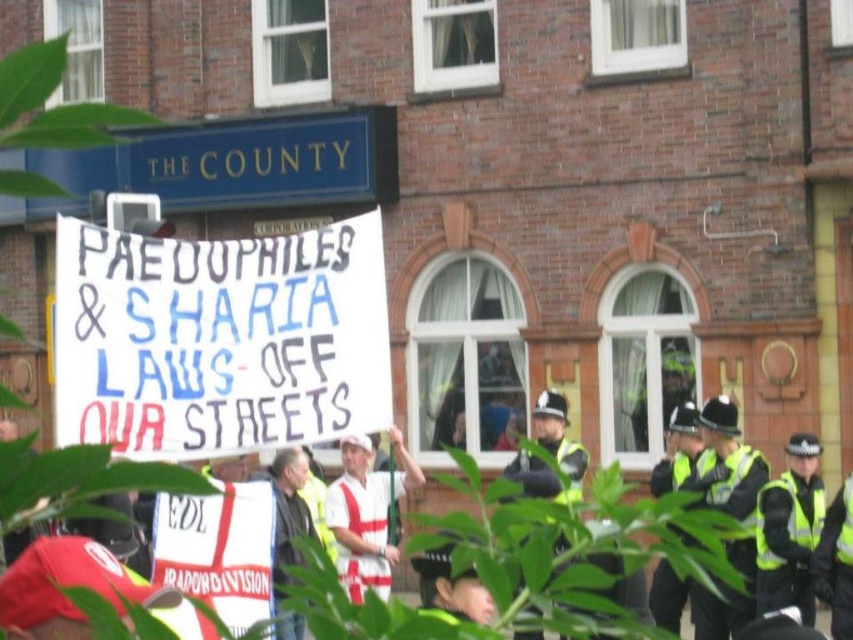
Does high-visibility yellow jacket at right have a greater width compared to white fabric shirt at center?

No, high-visibility yellow jacket at right is not wider than white fabric shirt at center.

Between point (758, 608) and point (326, 520), which one is positioned in front?

Point (758, 608)

Is point (814, 604) positioned before point (370, 460)?

That is True.

This screenshot has width=853, height=640. In order to click on high-visibility yellow jacket at right in this screenshot , I will do `click(790, 531)`.

Which is more to the right, white fabric shirt at center or dark gray jacket at center?

white fabric shirt at center is more to the right.

Who is more distant from viewer, (347,518) or (315,536)?

Positioned behind is point (347,518).

This screenshot has height=640, width=853. In order to click on white fabric shirt at center in this screenshot , I will do `click(366, 513)`.

Which is in front, point (764, 554) or point (296, 636)?

Point (296, 636)

Is high-visibility yellow jacket at right thinner than dark gray jacket at center?

Correct, high-visibility yellow jacket at right's width is less than dark gray jacket at center's.

I want to click on high-visibility yellow jacket at right, so click(790, 531).